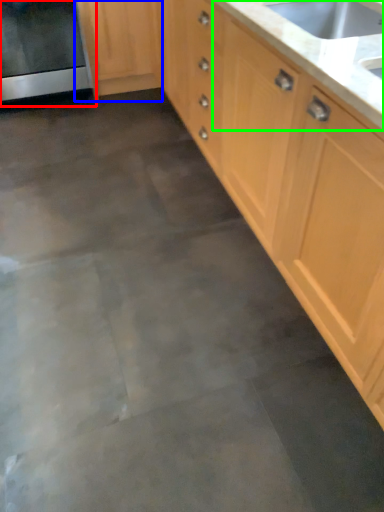
Question: Estimate the real-world distances between objects in this image. Which object is closer to oven (highlighted by a red box), cabinetry (highlighted by a blue box) or countertop (highlighted by a green box)?

Choices:
 (A) cabinetry
 (B) countertop

Answer: (A)